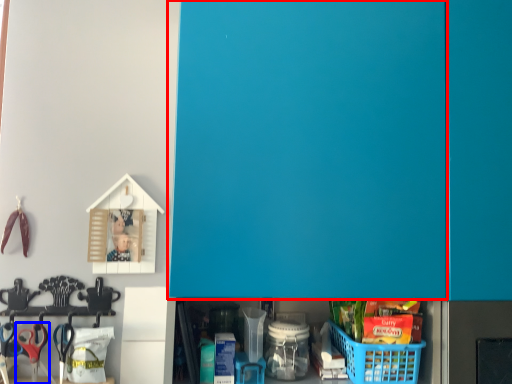
Question: Which of the following is the closest to the observer, door (highlighted by a red box) or scissors (highlighted by a blue box)?

Choices:
 (A) door
 (B) scissors

Answer: (A)